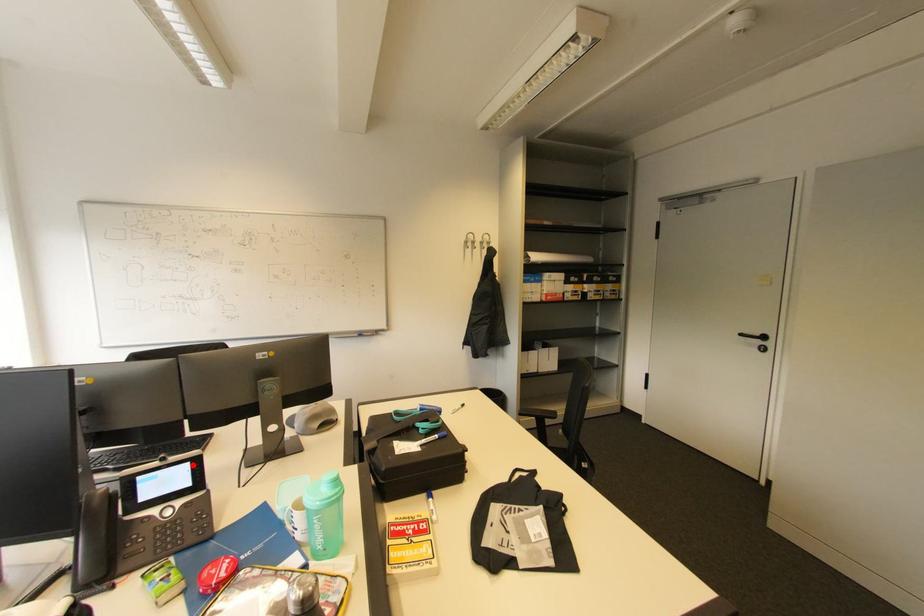
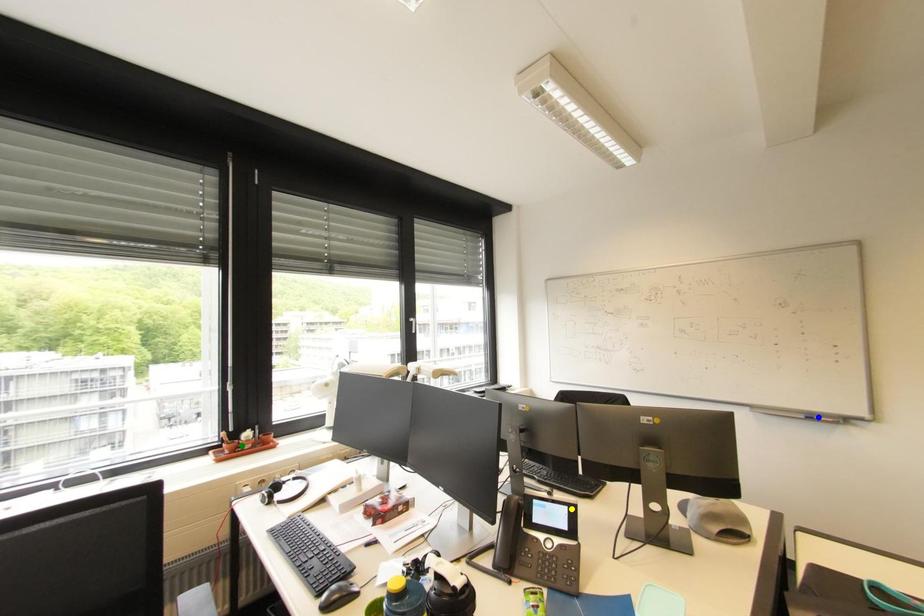
Question: I am providing you with two images of the same scene from different viewpoints. A red point is marked on the first image. You are given multiple points on the second image. Which mark in image 2 goes with the point in image 1?

Choices:
 (A) blue point
 (B) yellow point
 (C) green point

Answer: (B)